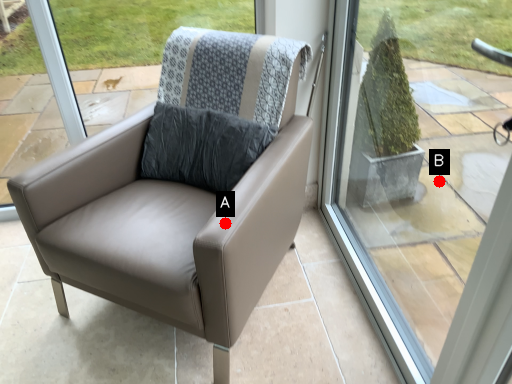
Question: Two points are circled on the image, labeled by A and B beside each circle. Which point appears closest to the camera in this image?

Choices:
 (A) A is closer
 (B) B is closer

Answer: (A)